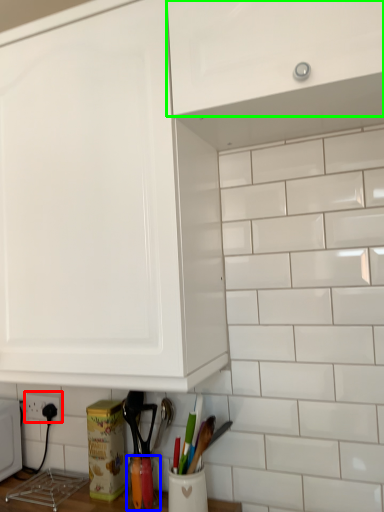
Question: Estimate the real-world distances between objects in this image. Which object is farther from electric outlet (highlighted by a red box), appliance (highlighted by a blue box) or cabinetry (highlighted by a green box)?

Choices:
 (A) appliance
 (B) cabinetry

Answer: (B)